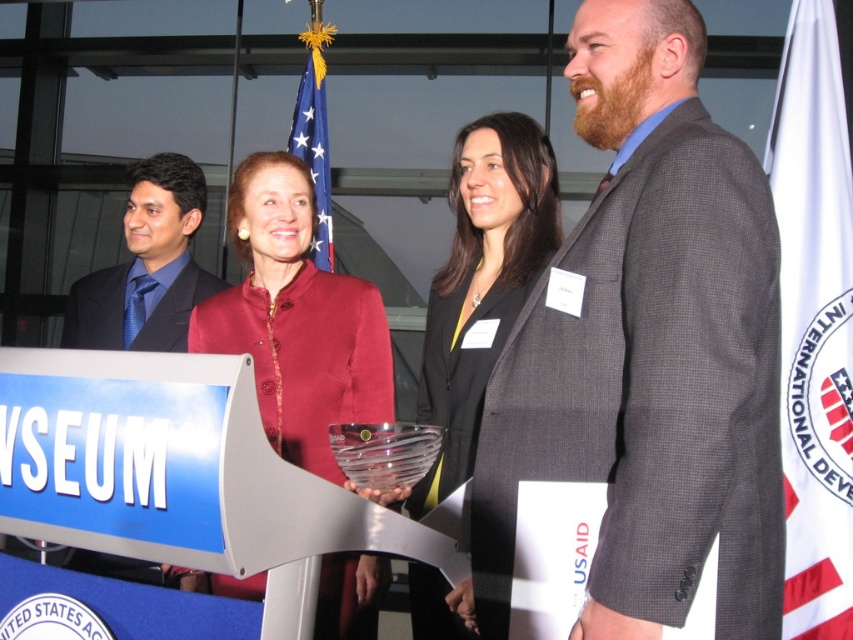
Question: Which of these objects is positioned farthest from the maroon satin blouse at center?

Choices:
 (A) white fabric flag at right
 (B) blue satin business suit at left

Answer: (A)

Question: Can you confirm if blue satin business suit at left is thinner than american flag at center?

Choices:
 (A) yes
 (B) no

Answer: (B)

Question: Does gray checkered suit at center appear over white fabric flag at right?

Choices:
 (A) yes
 (B) no

Answer: (B)

Question: Which point appears closest to the camera in this image?

Choices:
 (A) (287, 369)
 (B) (160, 305)
 (C) (492, 128)

Answer: (A)

Question: Which point appears farthest from the camera in this image?

Choices:
 (A) (291, 124)
 (B) (310, 380)

Answer: (A)

Question: Does white fabric flag at right appear under blue satin business suit at left?

Choices:
 (A) yes
 (B) no

Answer: (A)